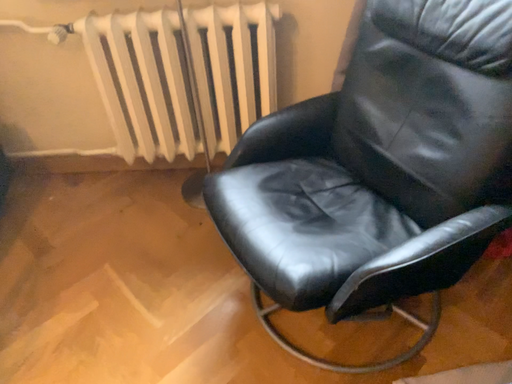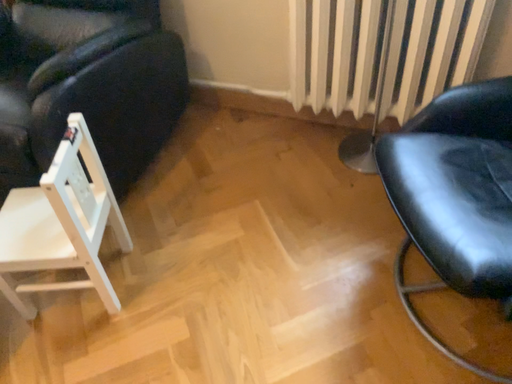
Question: Which way did the camera rotate in the video?

Choices:
 (A) rotated right
 (B) rotated left

Answer: (B)